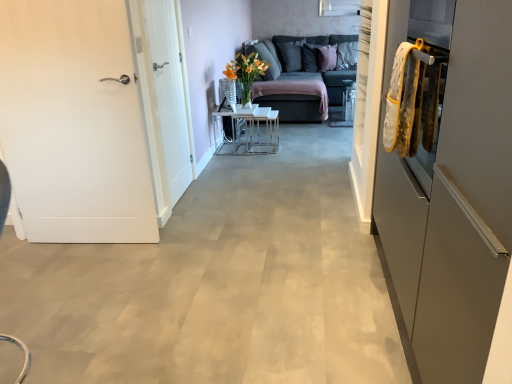
Question: Is white matte door at left, which is the 1th door from left to right, far from dark gray fabric pillow at upper center, positioned as the first pillow in left-to-right order?

Choices:
 (A) yes
 (B) no

Answer: (A)

Question: From the image's perspective, would you say white matte door at left, which is the 1th door from left to right, is positioned over dark gray fabric pillow at upper center, positioned as the first pillow in left-to-right order?

Choices:
 (A) yes
 (B) no

Answer: (B)

Question: Could dark gray fabric pillow at upper center, positioned as the first pillow in left-to-right order, be considered to be inside white matte door at left, which is the 1th door from left to right?

Choices:
 (A) no
 (B) yes

Answer: (A)

Question: From the image's perspective, is white matte door at left, the second door from the right, located beneath dark gray fabric pillow at upper center, positioned as the first pillow in left-to-right order?

Choices:
 (A) yes
 (B) no

Answer: (A)

Question: From a real-world perspective, does white matte door at left, which is the 1th door from left to right, stand above dark gray fabric pillow at upper center, positioned as the first pillow in left-to-right order?

Choices:
 (A) no
 (B) yes

Answer: (A)

Question: In terms of height, does dark gray fabric pillow at upper center, the second pillow when ordered from right to left, look taller or shorter compared to dark gray fabric couch at center?

Choices:
 (A) short
 (B) tall

Answer: (A)

Question: From a real-world perspective, is dark gray fabric pillow at upper center, positioned as the first pillow in left-to-right order, physically located above or below dark gray fabric couch at center?

Choices:
 (A) above
 (B) below

Answer: (A)

Question: In the image, is dark gray fabric pillow at upper center, positioned as the first pillow in left-to-right order, positioned in front of or behind dark gray fabric couch at center?

Choices:
 (A) behind
 (B) front

Answer: (A)

Question: Based on their sizes in the image, would you say dark gray fabric pillow at upper center, the second pillow when ordered from right to left, is bigger or smaller than dark gray fabric couch at center?

Choices:
 (A) big
 (B) small

Answer: (B)

Question: Is point (288, 87) positioned closer to the camera than point (164, 155)?

Choices:
 (A) closer
 (B) farther

Answer: (B)

Question: Would you say dark gray fabric couch at center is inside or outside white wood door at left, arranged as the 2th door when viewed from the left?

Choices:
 (A) outside
 (B) inside

Answer: (A)

Question: From the image's perspective, relative to white wood door at left, arranged as the 2th door when viewed from the left, is dark gray fabric couch at center above or below?

Choices:
 (A) above
 (B) below

Answer: (A)

Question: In terms of height, does dark gray fabric couch at center look taller or shorter compared to white wood door at left, arranged as the 2th door when viewed from the left?

Choices:
 (A) short
 (B) tall

Answer: (A)

Question: From the image's perspective, is dark gray fabric couch at center located above or below matte gray cabinet at right?

Choices:
 (A) above
 (B) below

Answer: (A)

Question: Looking at the image, does dark gray fabric couch at center seem bigger or smaller compared to matte gray cabinet at right?

Choices:
 (A) small
 (B) big

Answer: (B)